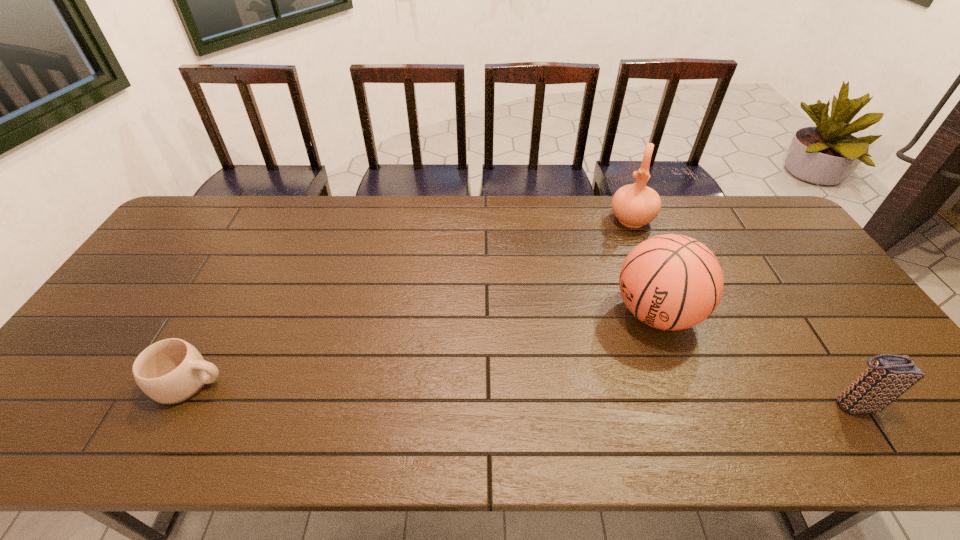
In order to click on the leftmost object in this screenshot , I will do `click(171, 371)`.

This screenshot has height=540, width=960. What are the coordinates of `mug` in the screenshot? It's located at (171, 371).

Find the location of a particular element. This screenshot has width=960, height=540. clutch bag is located at coordinates (889, 376).

At what (x,y) coordinates should I click in order to perform the action: click on the second shortest object. Please return your answer as a coordinate pair (x, y). Image resolution: width=960 pixels, height=540 pixels. Looking at the image, I should click on (889, 376).

The height and width of the screenshot is (540, 960). In order to click on the third nearest object in this screenshot , I will do `click(672, 282)`.

I want to click on pottery, so click(635, 205).

Where is `free space located on the side of the mug with the handle`? This screenshot has height=540, width=960. free space located on the side of the mug with the handle is located at coordinates (383, 383).

Find the location of a particular element. The image size is (960, 540). vacant space located with the zip open on the second shortest object is located at coordinates (924, 404).

Where is `free space located on the surface of the second farthest object near the brand logo`? This screenshot has width=960, height=540. free space located on the surface of the second farthest object near the brand logo is located at coordinates (598, 355).

At what (x,y) coordinates should I click in order to perform the action: click on vacant space located 0.240m on the surface of the second farthest object near the brand logo. Please return your answer as a coordinate pair (x, y). Looking at the image, I should click on (561, 382).